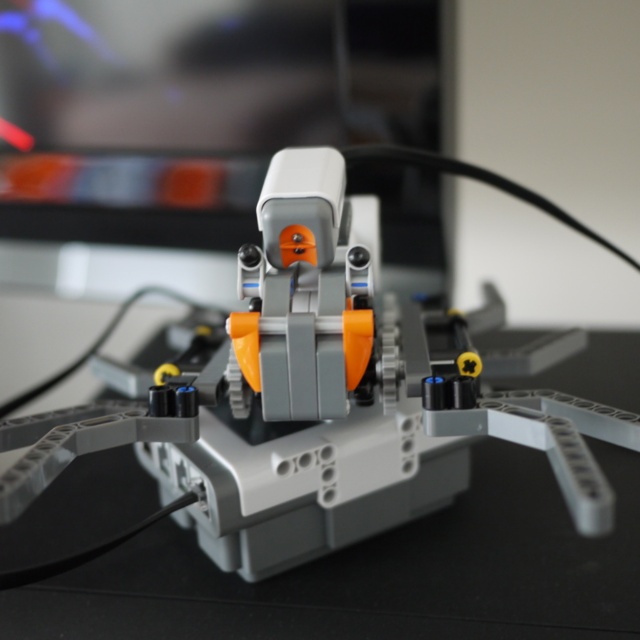
You are a technician trying to troubleshoot an issue with the matte plastic robot at center and the matte black monitor at upper center. From your current position, which object is closer to you?

The matte plastic robot at center is closer to you because it is in front of the matte black monitor at upper center.

What is located at the coordinates point (321, 392) in the image?

The point (321, 392) indicates a matte plastic robot at center.